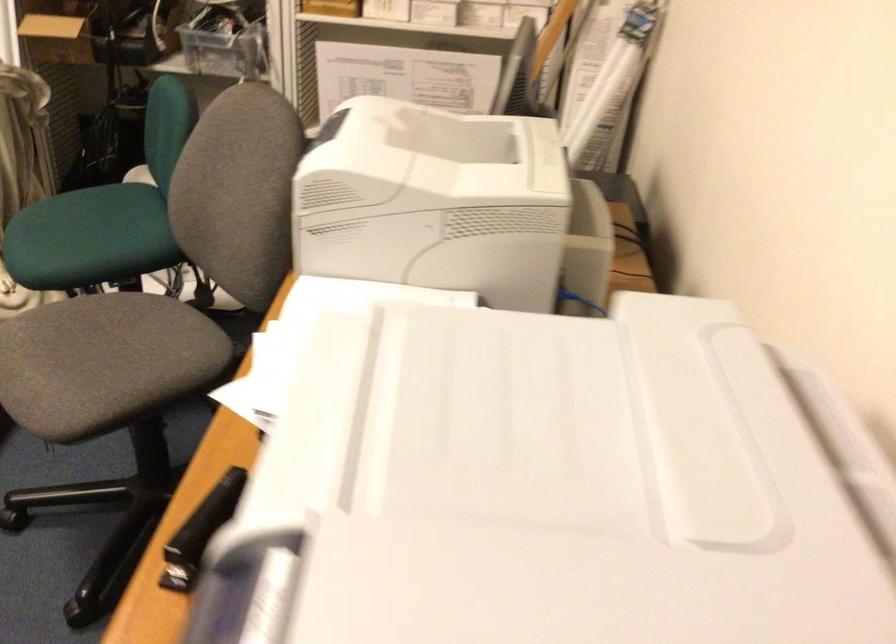
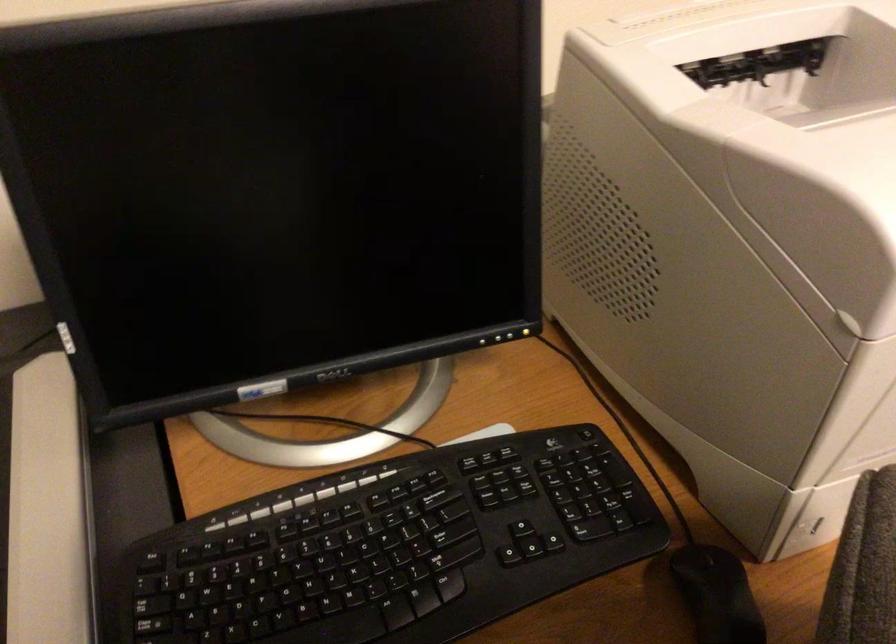
Locate, in the second image, the point that corresponds to the point at 540,120 in the first image.

(616, 21)